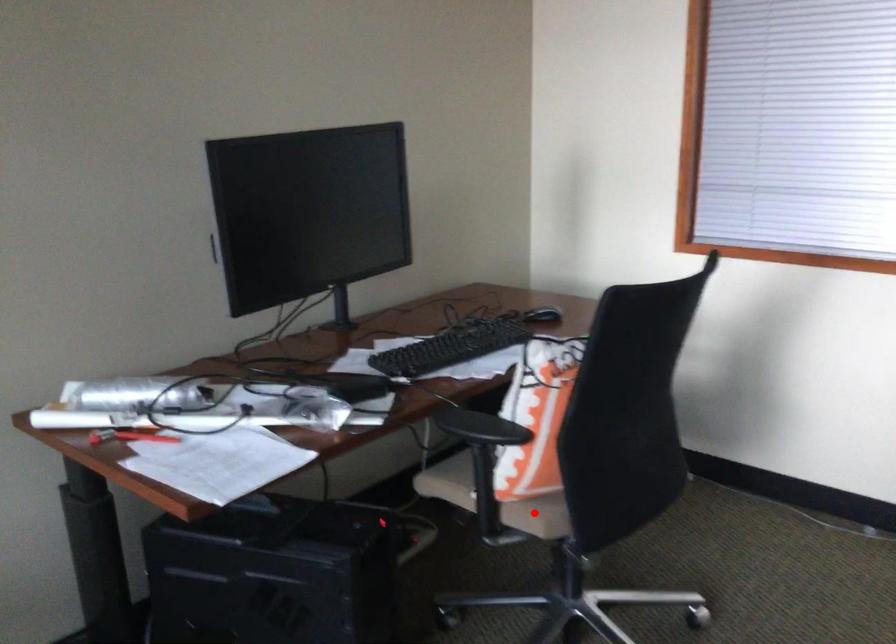
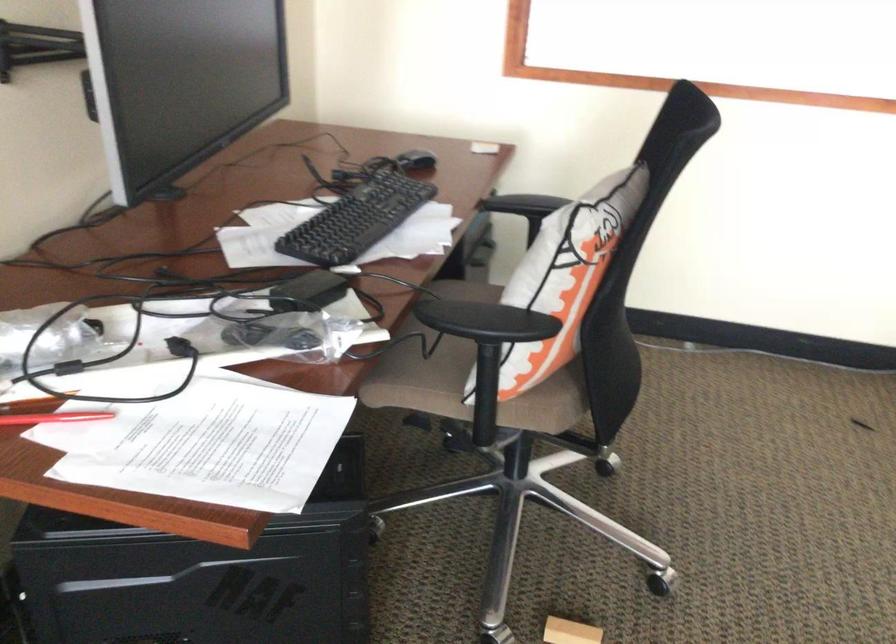
Question: I am providing you with two images of the same scene from different viewpoints. Image1 has a red point marked. In image2, the corresponding 3D location appears at what relative position? Reply with the corresponding letter.

Choices:
 (A) Closer
 (B) Farther

Answer: (A)